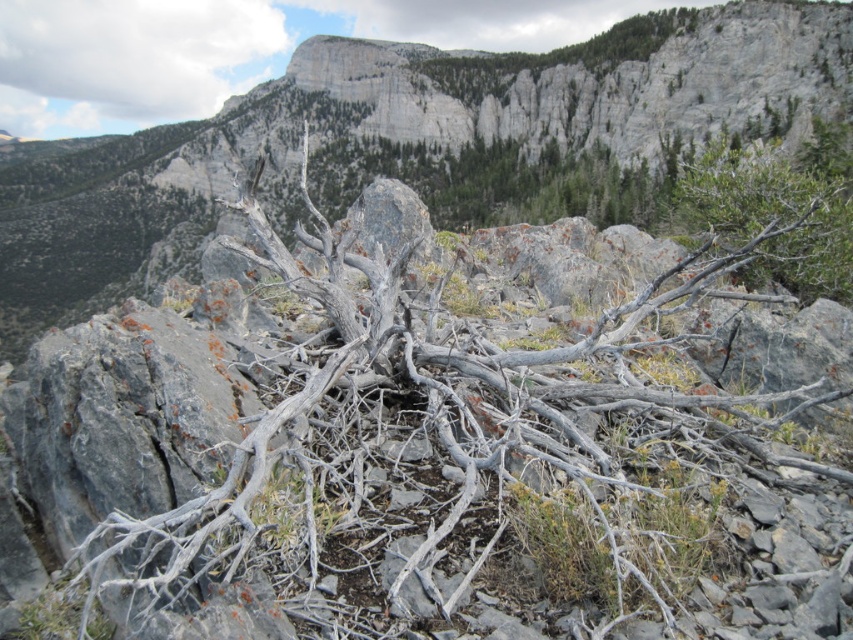
You are a geologist analyzing the mountainous landscape. You need to locate the gray rock at center. What are its coordinates?

The gray rock at center is located at coordinates point [419,144].

You are a hiker trying to navigate through the mountainous terrain. You see a gray rock at center and a gray rocky cliff at upper center. Which object is positioned to the left when viewed from your perspective?

The gray rock at center is positioned to the left of the gray rocky cliff at upper center.

You are a hiker trying to navigate through the rugged terrain. You see a gray rock at center and a green leafy shrub at upper right. Which object is located higher up in the landscape?

The gray rock at center is positioned over the green leafy shrub at upper right, so the gray rock at center is higher up in the landscape.